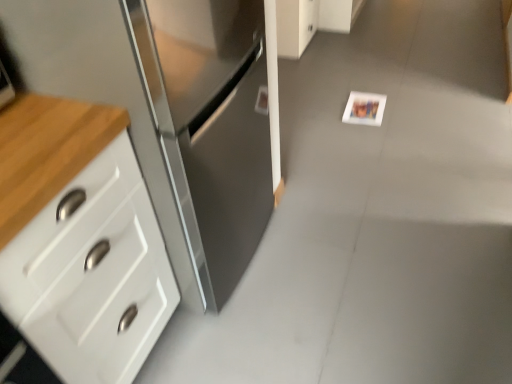
Question: From the image's perspective, does white glossy cabinet at upper center, the first cabinetry positioned from the back, appear higher than white matte postcard at center?

Choices:
 (A) no
 (B) yes

Answer: (B)

Question: Is white glossy cabinet at upper center, placed as the 1th cabinetry when sorted from right to left, directly adjacent to white matte postcard at center?

Choices:
 (A) no
 (B) yes

Answer: (A)

Question: Does white glossy cabinet at upper center, arranged as the second cabinetry when viewed from the front, have a lesser width compared to white matte postcard at center?

Choices:
 (A) no
 (B) yes

Answer: (A)

Question: From the image's perspective, would you say white glossy cabinet at upper center, which appears as the second cabinetry when viewed from the left, is shown under white matte postcard at center?

Choices:
 (A) no
 (B) yes

Answer: (A)

Question: Is white glossy cabinet at upper center, the second cabinetry when ordered from bottom to top, not close to white matte postcard at center?

Choices:
 (A) no
 (B) yes

Answer: (A)

Question: From a real-world perspective, is white matte postcard at center above or below white glossy cabinet at upper center, the second cabinetry when ordered from bottom to top?

Choices:
 (A) below
 (B) above

Answer: (A)

Question: In the image, is white matte postcard at center on the left side or the right side of white glossy cabinet at upper center, arranged as the second cabinetry when viewed from the front?

Choices:
 (A) right
 (B) left

Answer: (A)

Question: Is white matte postcard at center spatially inside white glossy cabinet at upper center, marked as the 1th cabinetry in a top-to-bottom arrangement, or outside of it?

Choices:
 (A) inside
 (B) outside

Answer: (B)

Question: Is white matte postcard at center taller or shorter than white glossy cabinet at upper center, marked as the 1th cabinetry in a top-to-bottom arrangement?

Choices:
 (A) tall
 (B) short

Answer: (B)

Question: Looking at the image, does white glossy cabinet at upper center, arranged as the second cabinetry when viewed from the front, seem bigger or smaller compared to stainless steel cabinet at left, positioned as the second cabinetry in right-to-left order?

Choices:
 (A) big
 (B) small

Answer: (B)

Question: Is white glossy cabinet at upper center, placed as the 1th cabinetry when sorted from right to left, inside the boundaries of stainless steel cabinet at left, positioned as the second cabinetry in right-to-left order, or outside?

Choices:
 (A) outside
 (B) inside

Answer: (A)

Question: In the image, is white glossy cabinet at upper center, marked as the 1th cabinetry in a top-to-bottom arrangement, positioned in front of or behind stainless steel cabinet at left, positioned as the second cabinetry in right-to-left order?

Choices:
 (A) front
 (B) behind

Answer: (B)

Question: From their relative heights in the image, would you say white glossy cabinet at upper center, the first cabinetry positioned from the back, is taller or shorter than stainless steel cabinet at left, positioned as the second cabinetry in right-to-left order?

Choices:
 (A) short
 (B) tall

Answer: (A)

Question: From their relative heights in the image, would you say white glossy cabinet at upper center, which appears as the second cabinetry when viewed from the left, is taller or shorter than white matte postcard at center?

Choices:
 (A) tall
 (B) short

Answer: (A)

Question: Is white glossy cabinet at upper center, marked as the 1th cabinetry in a top-to-bottom arrangement, wider or thinner than white matte postcard at center?

Choices:
 (A) wide
 (B) thin

Answer: (A)